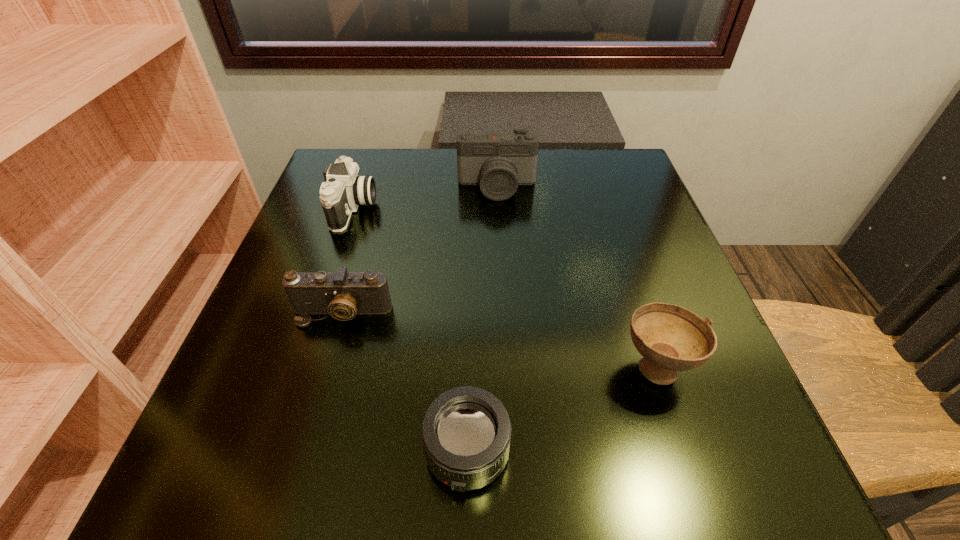
Where is `empty location between the soup bowl and the nearest camera`? Image resolution: width=960 pixels, height=540 pixels. empty location between the soup bowl and the nearest camera is located at coordinates (499, 340).

Image resolution: width=960 pixels, height=540 pixels. In order to click on vacant area that lies between the rightmost camera and the telephoto lens in this screenshot , I will do `click(482, 320)`.

The height and width of the screenshot is (540, 960). Find the location of `vacant area between the third farthest object and the nearest object`. vacant area between the third farthest object and the nearest object is located at coordinates (405, 383).

Where is `free space between the nearest object and the third nearest object`? free space between the nearest object and the third nearest object is located at coordinates (405, 383).

Image resolution: width=960 pixels, height=540 pixels. I want to click on free space between the rightmost object and the third nearest object, so click(x=499, y=340).

The height and width of the screenshot is (540, 960). I want to click on object that can be found as the third closest to the rightmost camera, so click(670, 338).

Identify which object is located as the fourth nearest to the rightmost camera. Please provide its 2D coordinates. Your answer should be formatted as a tuple, i.e. [(x, y)], where the tuple contains the x and y coordinates of a point satisfying the conditions above.

[(466, 431)]

This screenshot has width=960, height=540. Find the location of `camera that is the second closest to the nearest camera`. camera that is the second closest to the nearest camera is located at coordinates (498, 162).

At what (x,y) coordinates should I click in order to perform the action: click on camera object that ranks as the closest to the nearest object. Please return your answer as a coordinate pair (x, y). Looking at the image, I should click on (343, 295).

The width and height of the screenshot is (960, 540). What are the coordinates of `blank area in the image that satisfies the following two spatial constraints: 1. at the lens of the fourth farthest object; 2. on the left side of the rightmost camera` in the screenshot? It's located at (505, 366).